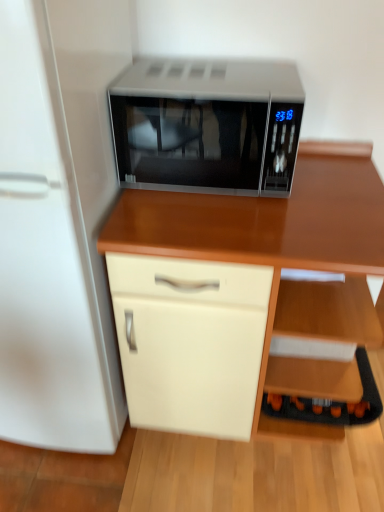
Identify the location of vacant space in front of sleek silver microwave at center. The height and width of the screenshot is (512, 384). (230, 217).